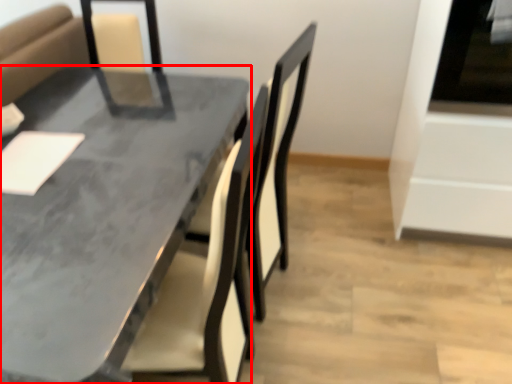
Question: From the image's perspective, where is table (annotated by the red box) located in relation to oven in the image?

Choices:
 (A) below
 (B) above

Answer: (A)